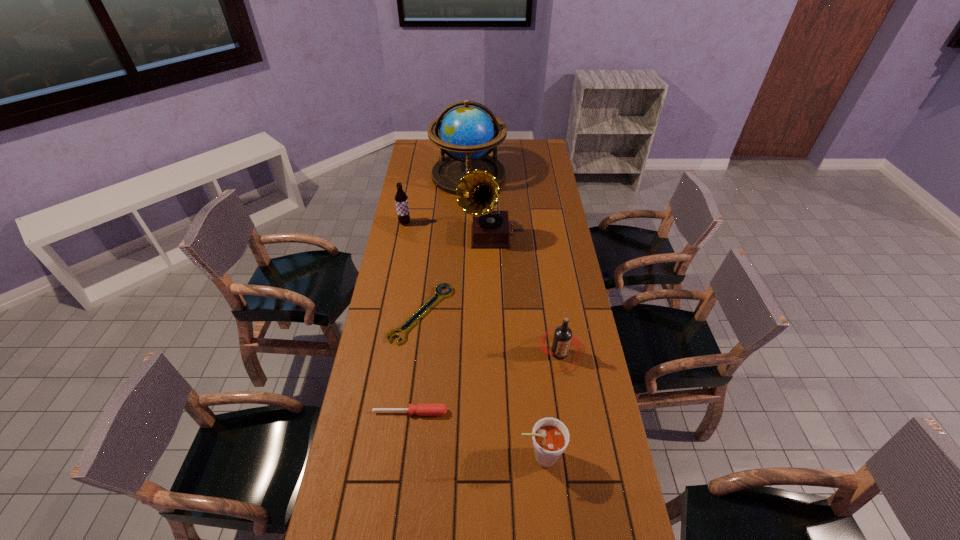
Identify the location of vacant space situated from the horn of the phonograph record. (416, 235).

Image resolution: width=960 pixels, height=540 pixels. What are the coordinates of `free point located from the horn of the phonograph record` in the screenshot? It's located at (446, 235).

Locate an element on the screen. This screenshot has height=540, width=960. vacant space positioned from the horn of the phonograph record is located at coordinates (436, 235).

Find the location of `blank space located 0.310m on the right of the farthest root beer`. blank space located 0.310m on the right of the farthest root beer is located at coordinates (478, 223).

Locate an element on the screen. vacant space situated 0.200m on the label of the second farthest root beer is located at coordinates (571, 431).

Locate an element on the screen. Image resolution: width=960 pixels, height=540 pixels. vacant space located 0.320m on the drink side of the nearest object is located at coordinates (406, 457).

At what (x,y) coordinates should I click in order to perform the action: click on vacant space located on the drink side of the nearest object. Please return your answer as a coordinate pair (x, y). This screenshot has height=540, width=960. Looking at the image, I should click on (378, 457).

Identify the location of vacant region located on the drink side of the nearest object. The height and width of the screenshot is (540, 960). (486, 457).

This screenshot has width=960, height=540. Identify the location of free space located on the front of the second shortest object. [396, 529].

Locate an element on the screen. The image size is (960, 540). free point located on the front of the shortest object is located at coordinates (409, 417).